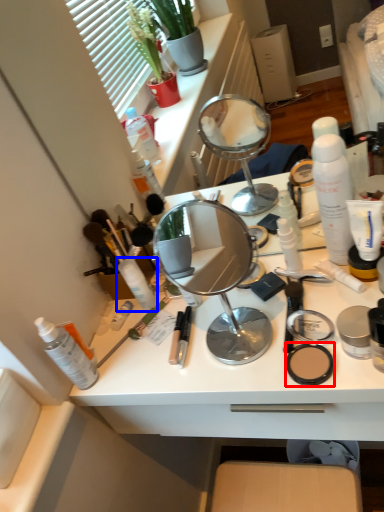
Question: Among these objects, which one is farthest to the camera, face powder (highlighted by a red box) or toiletry (highlighted by a blue box)?

Choices:
 (A) face powder
 (B) toiletry

Answer: (B)